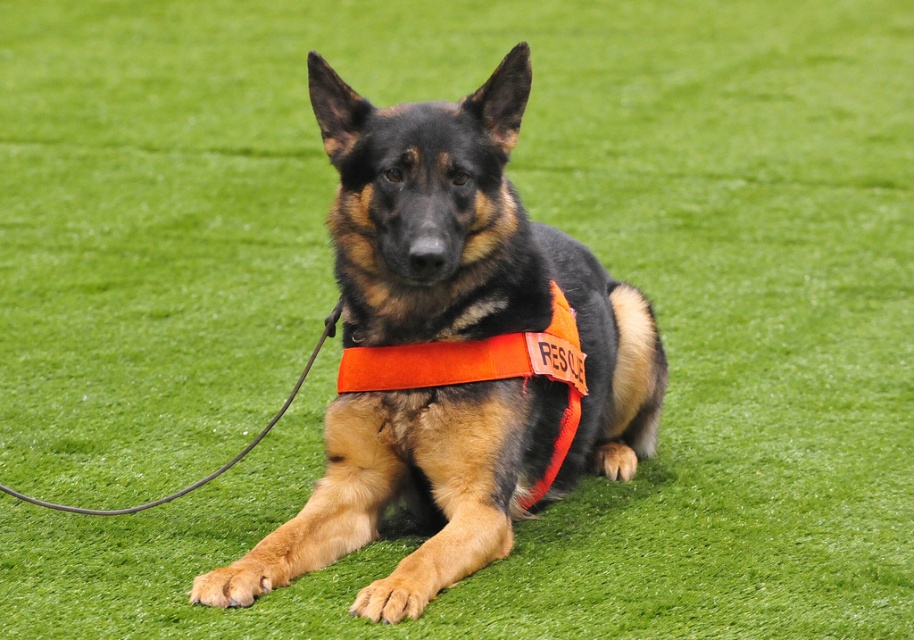
Question: Considering the relative positions of orange fabric vest at center and orange fabric neckband at center in the image provided, where is orange fabric vest at center located with respect to orange fabric neckband at center?

Choices:
 (A) above
 (B) below

Answer: (A)

Question: Which object appears closest to the camera in this image?

Choices:
 (A) orange fabric neckband at center
 (B) orange fabric vest at center

Answer: (B)

Question: Which point is closer to the camera?

Choices:
 (A) orange fabric neckband at center
 (B) orange fabric vest at center

Answer: (B)

Question: Which object is closer to the camera taking this photo?

Choices:
 (A) orange fabric vest at center
 (B) orange fabric neckband at center

Answer: (A)

Question: Is orange fabric vest at center further to camera compared to orange fabric neckband at center?

Choices:
 (A) no
 (B) yes

Answer: (A)

Question: Does orange fabric vest at center appear on the left side of orange fabric neckband at center?

Choices:
 (A) no
 (B) yes

Answer: (A)